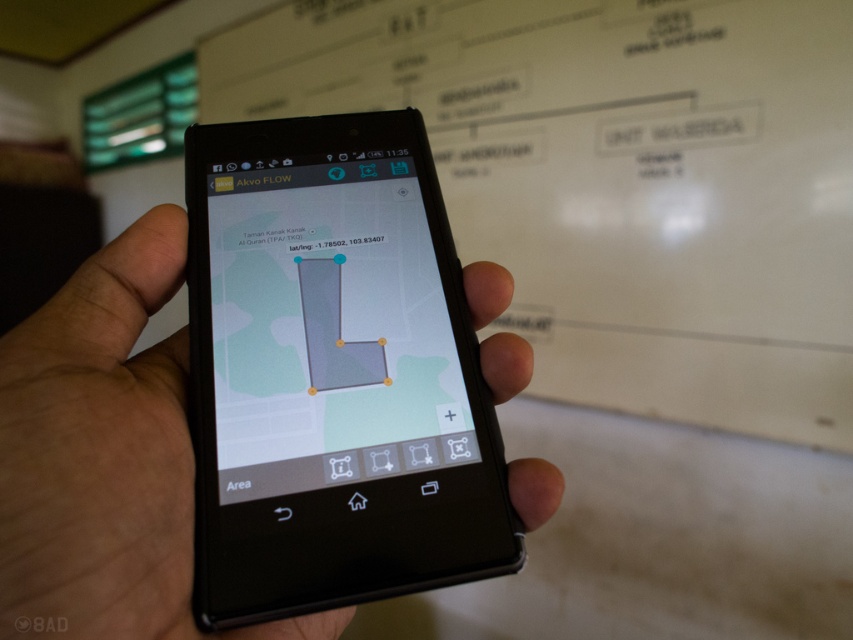
Question: Does black matte phone at center have a greater width compared to matte black phone at center?

Choices:
 (A) no
 (B) yes

Answer: (B)

Question: Is black matte phone at center below matte black phone at center?

Choices:
 (A) no
 (B) yes

Answer: (B)

Question: Which point is closer to the camera taking this photo?

Choices:
 (A) (283, 400)
 (B) (32, 486)

Answer: (B)

Question: Which point is closer to the camera?

Choices:
 (A) (329, 189)
 (B) (158, 403)

Answer: (B)

Question: Does black matte phone at center appear on the left side of matte black phone at center?

Choices:
 (A) yes
 (B) no

Answer: (A)

Question: Among these objects, which one is nearest to the camera?

Choices:
 (A) matte black phone at center
 (B) black matte phone at center

Answer: (B)